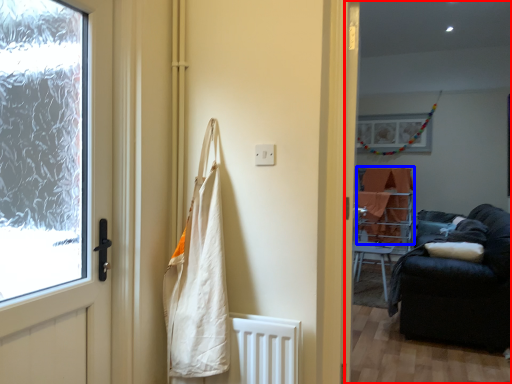
Question: Among these objects, which one is nearest to the camera, corridor (highlighted by a red box) or blanket (highlighted by a blue box)?

Choices:
 (A) corridor
 (B) blanket

Answer: (A)